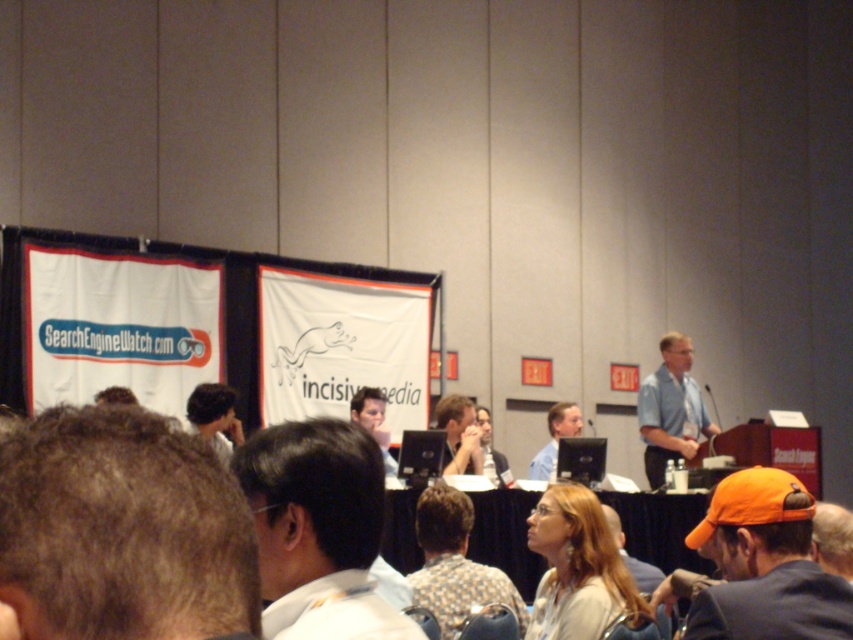
Can you confirm if matte black laptop at center is bigger than orange baseball cap at lower right?

A: Actually, matte black laptop at center might be smaller than orange baseball cap at lower right.

Is matte black laptop at center above orange baseball cap at lower right?

Yes.

Image resolution: width=853 pixels, height=640 pixels. Describe the element at coordinates (459, 435) in the screenshot. I see `matte black laptop at center` at that location.

Where is `matte black laptop at center`? This screenshot has height=640, width=853. matte black laptop at center is located at coordinates (459, 435).

Which is more to the right, matte white blouse at center or orange baseball cap at lower right?

orange baseball cap at lower right

Can you confirm if matte white blouse at center is positioned to the left of orange baseball cap at lower right?

Indeed, matte white blouse at center is positioned on the left side of orange baseball cap at lower right.

I want to click on matte white blouse at center, so [577, 568].

Does dark brown hair at center appear on the left side of orange baseball cap at lower right?

Yes, dark brown hair at center is to the left of orange baseball cap at lower right.

Who is taller, dark brown hair at center or orange baseball cap at lower right?

orange baseball cap at lower right

Locate an element on the screen. The image size is (853, 640). dark brown hair at center is located at coordinates (213, 417).